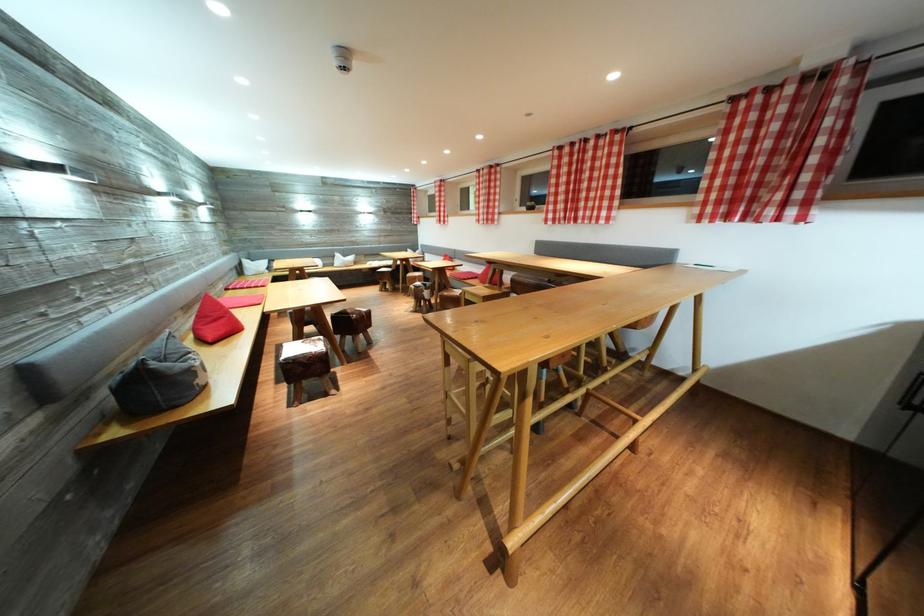
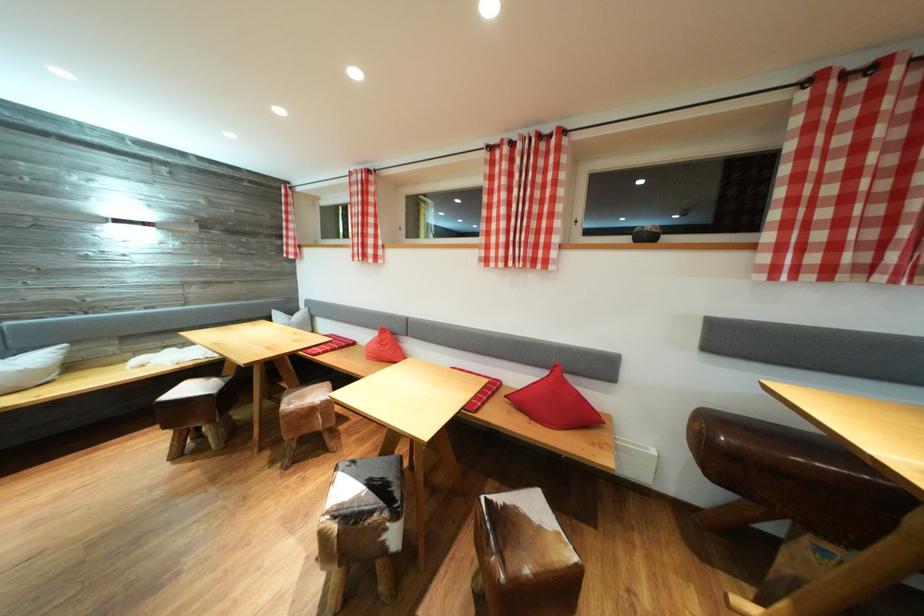
The point at (393, 289) is marked in the first image. Where is the corresponding point in the second image?

(203, 434)